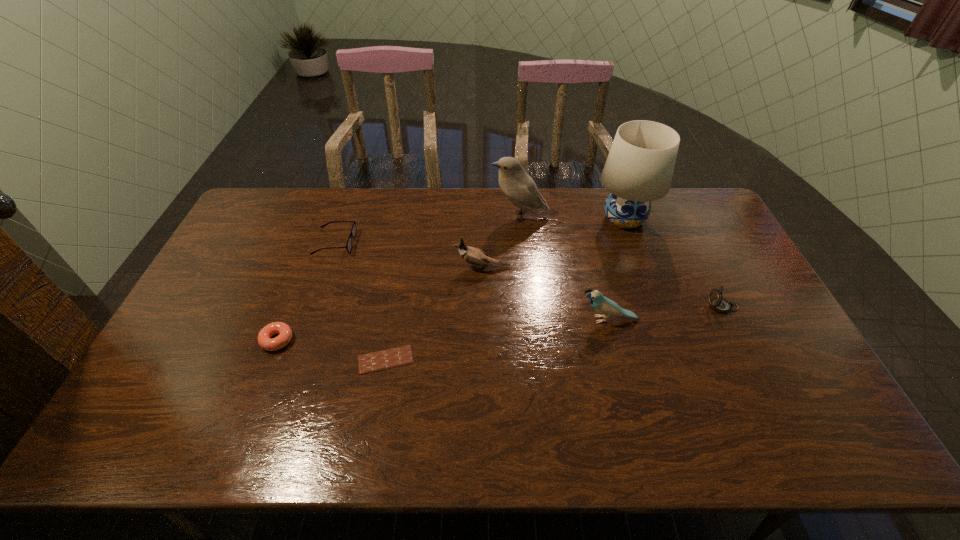
This screenshot has height=540, width=960. What are the coordinates of `chocolate bar` in the screenshot? It's located at (381, 360).

Find the location of a particular element. Image resolution: width=960 pixels, height=540 pixels. vacant area situated 0.350m on the front-facing side of the tallest object is located at coordinates (660, 321).

The height and width of the screenshot is (540, 960). Identify the location of vacant space located at the beak of the tallest bird. (434, 216).

Locate an element on the screen. The width and height of the screenshot is (960, 540). free space located 0.310m at the beak of the tallest bird is located at coordinates (403, 216).

The width and height of the screenshot is (960, 540). Identify the location of free location located 0.360m at the beak of the tallest bird. (390, 216).

Locate an element on the screen. free space located at the face of the fifth nearest object is located at coordinates (417, 267).

This screenshot has width=960, height=540. In order to click on vacant region located at the face of the fifth nearest object in this screenshot , I will do `click(400, 267)`.

The image size is (960, 540). Find the location of `free region located at the face of the fifth nearest object`. free region located at the face of the fifth nearest object is located at coordinates (410, 267).

Where is `vacant region located at the face of the nearest bird`? vacant region located at the face of the nearest bird is located at coordinates (504, 320).

At what (x,y) coordinates should I click in order to perform the action: click on free space located 0.110m at the face of the nearest bird. Please return your answer as a coordinate pair (x, y). Image resolution: width=960 pixels, height=540 pixels. Looking at the image, I should click on tap(540, 320).